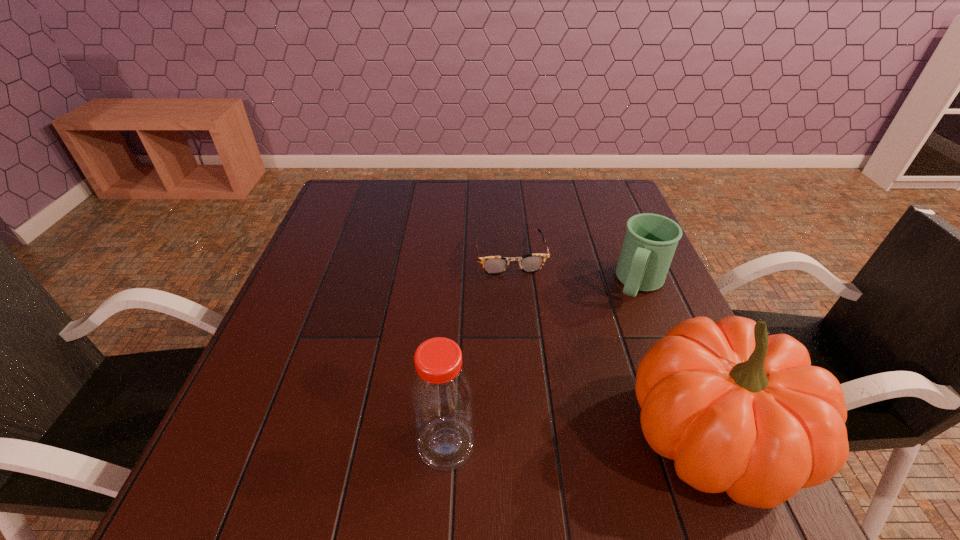
Identify the location of bottle. The width and height of the screenshot is (960, 540). (441, 394).

The height and width of the screenshot is (540, 960). Identify the location of pumpkin. (739, 411).

The image size is (960, 540). In order to click on the shortest object in this screenshot , I will do `click(493, 265)`.

Identify the location of mug. (650, 241).

The image size is (960, 540). I want to click on blank space located 0.180m on the right of the bottle, so click(579, 444).

Identify the location of free space located on the back of the pumpkin. (635, 254).

Find the location of `vacant space located on the frame of the shortest object`. vacant space located on the frame of the shortest object is located at coordinates coord(532,350).

The image size is (960, 540). Find the location of `vacant space located on the frame of the shortest object`. vacant space located on the frame of the shortest object is located at coordinates coord(525,319).

Where is `vacant space located 0.120m on the frame of the shortest object`? vacant space located 0.120m on the frame of the shortest object is located at coordinates (522, 309).

Image resolution: width=960 pixels, height=540 pixels. Find the location of `vacant space located 0.250m on the side of the third tallest object with the handle`. vacant space located 0.250m on the side of the third tallest object with the handle is located at coordinates (597, 382).